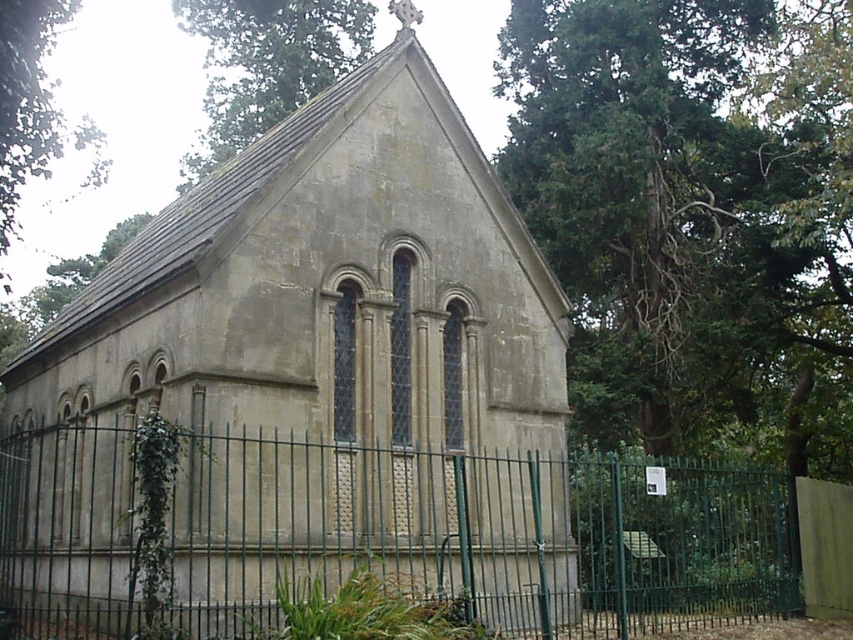
In the scene shown: Who is higher up, matte stone church at center or green leafy tree at upper center?

green leafy tree at upper center is above.

Which of these two, matte stone church at center or green leafy tree at upper center, stands shorter?

Standing shorter between the two is green leafy tree at upper center.

I want to click on matte stone church at center, so click(x=314, y=371).

Locate an element on the screen. matte stone church at center is located at coordinates (314, 371).

Is the position of matte stone church at center more distant than that of green leafy tree at upper left?

No, matte stone church at center is closer to the viewer.

Based on the photo, can you confirm if matte stone church at center is smaller than green leafy tree at upper left?

Correct, matte stone church at center occupies less space than green leafy tree at upper left.

Where is `matte stone church at center`? The image size is (853, 640). matte stone church at center is located at coordinates (314, 371).

Does green metal fence at lower center appear on the left side of green leafy tree at upper center?

No, green metal fence at lower center is not to the left of green leafy tree at upper center.

This screenshot has height=640, width=853. What do you see at coordinates (386, 532) in the screenshot? I see `green metal fence at lower center` at bounding box center [386, 532].

Find the location of a particular element. This screenshot has height=640, width=853. green metal fence at lower center is located at coordinates (386, 532).